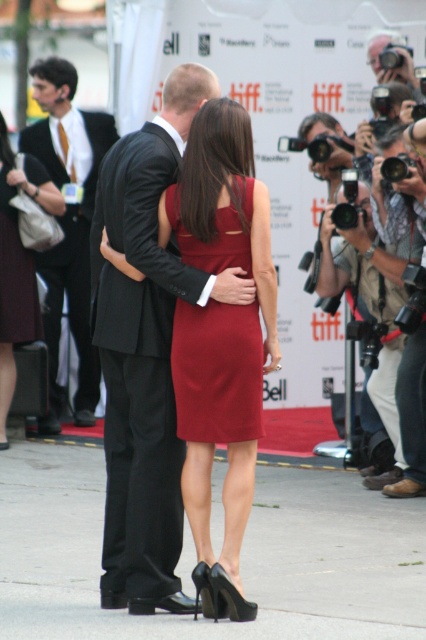
Question: Which point appears farthest from the camera in this image?

Choices:
 (A) (49, 260)
 (B) (158, 236)
 (C) (233, 433)

Answer: (A)

Question: Estimate the real-world distances between objects in this image. Which object is closer to the matte burgundy dress at left?

Choices:
 (A) matte black suit at center
 (B) burgundy satin dress at center

Answer: (A)

Question: Does satin red dress at center appear under matte black dress at center?

Choices:
 (A) yes
 (B) no

Answer: (A)

Question: Estimate the real-world distances between objects in this image. Which object is closer to the matte burgundy dress at left?

Choices:
 (A) matte black suit at center
 (B) burgundy satin dress at center
 (C) satin red dress at center

Answer: (A)

Question: Does black satin suit at center have a larger size compared to satin red dress at center?

Choices:
 (A) no
 (B) yes

Answer: (B)

Question: Does satin red dress at center appear over burgundy satin dress at center?

Choices:
 (A) yes
 (B) no

Answer: (B)